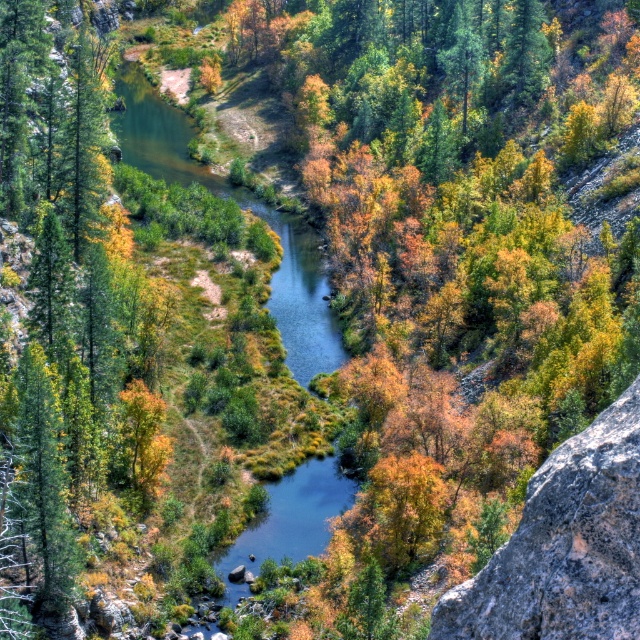
Question: Which point is farther from the camera taking this photo?

Choices:
 (A) (12, 118)
 (B) (493, 593)

Answer: (A)

Question: From the image, what is the correct spatial relationship of green matte tree at left in relation to gray rough rock at right?

Choices:
 (A) below
 (B) above

Answer: (B)

Question: Can you confirm if green matte tree at left is smaller than gray rough rock at right?

Choices:
 (A) yes
 (B) no

Answer: (B)

Question: Does green matte tree at left lie behind gray rough rock at right?

Choices:
 (A) yes
 (B) no

Answer: (A)

Question: Which point is farther from the camera taking this photo?

Choices:
 (A) (563, 499)
 (B) (16, 579)

Answer: (B)